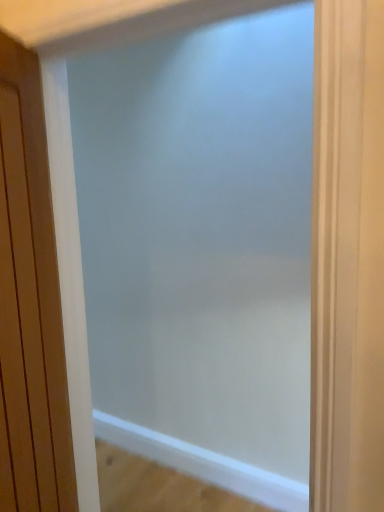
Question: Would you say wooden door at left is inside or outside frosted glass screen door at center?

Choices:
 (A) inside
 (B) outside

Answer: (B)

Question: Based on their positions, is wooden door at left located to the left or right of frosted glass screen door at center?

Choices:
 (A) right
 (B) left

Answer: (B)

Question: From the image's perspective, is wooden door at left located above or below frosted glass screen door at center?

Choices:
 (A) above
 (B) below

Answer: (A)

Question: Is frosted glass screen door at center inside or outside of wooden door at left?

Choices:
 (A) outside
 (B) inside

Answer: (A)

Question: From a real-world perspective, is frosted glass screen door at center above or below wooden door at left?

Choices:
 (A) below
 (B) above

Answer: (A)

Question: Considering the positions of frosted glass screen door at center and wooden door at left in the image, is frosted glass screen door at center taller or shorter than wooden door at left?

Choices:
 (A) short
 (B) tall

Answer: (B)

Question: Relative to wooden door at left, is frosted glass screen door at center in front or behind?

Choices:
 (A) behind
 (B) front

Answer: (A)